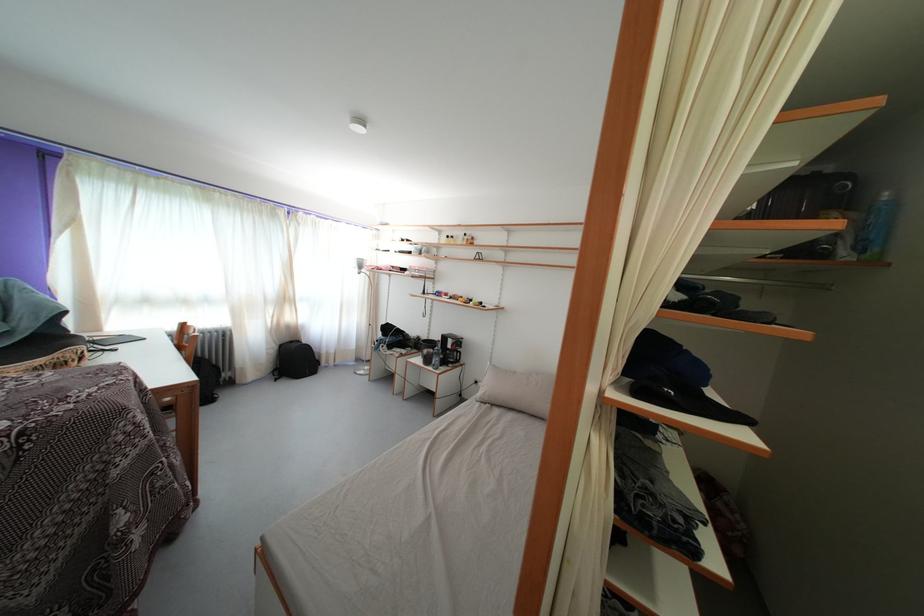
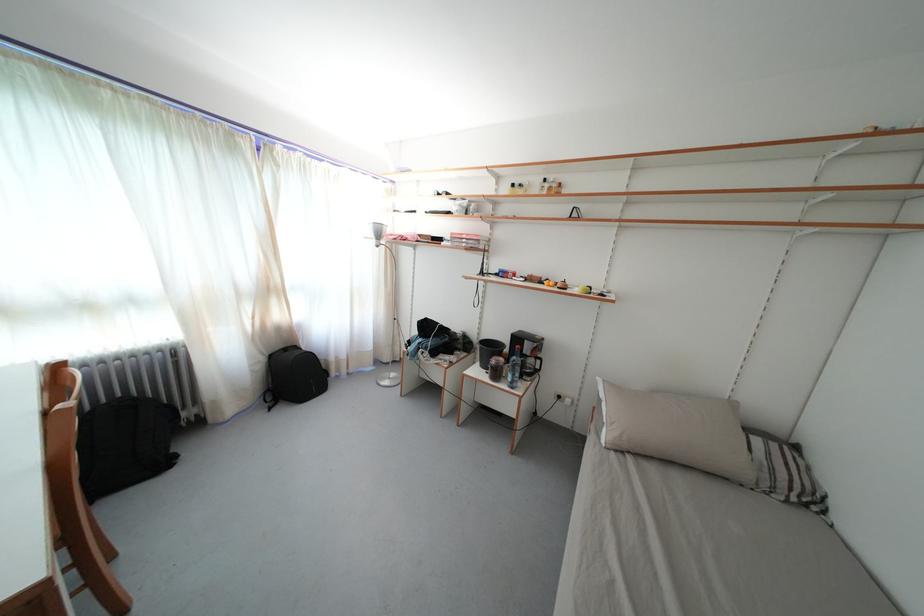
In the second image, find the point that corresponds to pixel 451 344 in the first image.

(524, 345)